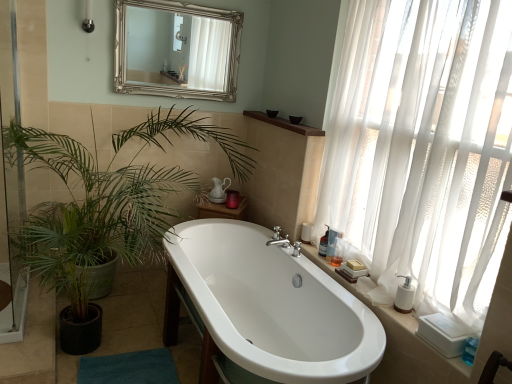
The width and height of the screenshot is (512, 384). What do you see at coordinates (106, 201) in the screenshot?
I see `green leafy plant at upper left` at bounding box center [106, 201].

Locate an element on the screen. Image resolution: width=512 pixels, height=384 pixels. white ceramic counter top at right is located at coordinates (401, 342).

The height and width of the screenshot is (384, 512). Find the location of `translucent plastic bottle at right, the 1th toiletry positioned from the front`. translucent plastic bottle at right, the 1th toiletry positioned from the front is located at coordinates [338, 251].

What is the approximate height of transparent glass screen door at left?

1.77 meters.

The image size is (512, 384). Identify the location of white glossy bathtub at center. (265, 309).

Considering the positions of objects transparent glass screen door at left and white matte soap dispenser at right in the image provided, who is more to the right, transparent glass screen door at left or white matte soap dispenser at right?

white matte soap dispenser at right.

Is point (1, 133) closer or farther from the camera than point (406, 286)?

Point (1, 133) appears to be farther away from the viewer than point (406, 286).

From a real-world perspective, is transparent glass screen door at left below white matte soap dispenser at right?

Actually, transparent glass screen door at left is physically above white matte soap dispenser at right in the real world.

What are the coordinates of `soap dispenser below the transparent glass screen door at left (from the image's perspective)` in the screenshot? It's located at (404, 296).

Would you say brown wood shelf at upper center is inside or outside white sheer curtain at right?

brown wood shelf at upper center is outside white sheer curtain at right.

Is brown wood shelf at upper center turned away from white sheer curtain at right?

No, brown wood shelf at upper center is not facing the opposite direction of white sheer curtain at right.

Is point (261, 113) positioned before point (439, 248)?

No.

Is white plastic soap dispenser at right, which appears as the 2th toiletry when viewed from the front, at the back of white glossy bathtub at center?

Yes, white glossy bathtub at center is positioned with its back facing white plastic soap dispenser at right, which appears as the 2th toiletry when viewed from the front.

Does white glossy bathtub at center have a greater width compared to white plastic soap dispenser at right, which is the 2th toiletry in back-to-front order?

Yes, white glossy bathtub at center is wider than white plastic soap dispenser at right, which is the 2th toiletry in back-to-front order.

Does point (174, 340) appear closer or farther from the camera than point (332, 232)?

Point (174, 340) appears to be farther away from the viewer than point (332, 232).

Between white glossy bathtub at center and white plastic soap dispenser at right, which appears as the 2th toiletry when viewed from the front, which one has more height?

Standing taller between the two is white glossy bathtub at center.

Based on the photo, visually, is transparent glass screen door at left positioned to the left or to the right of silver/gilded mirror at upper center?

transparent glass screen door at left is positioned on silver/gilded mirror at upper center's left side.

Does point (22, 158) lie behind point (136, 64)?

No, (22, 158) is closer to viewer.

Which object is more forward, transparent glass screen door at left or silver/gilded mirror at upper center?

transparent glass screen door at left is in front.

Is white plastic soap dispenser at right, which appears as the 2th toiletry when viewed from the front, closer to the viewer compared to white ceramic counter top at right?

That is False.

Which is behind, point (330, 253) or point (426, 375)?

Positioned behind is point (330, 253).

Are white plastic soap dispenser at right, which appears as the 2th toiletry when viewed from the front, and white ceramic counter top at right far apart?

No, white plastic soap dispenser at right, which appears as the 2th toiletry when viewed from the front, is in close proximity to white ceramic counter top at right.

From a real-world perspective, is white plastic soap dispenser at right, which appears as the 2th toiletry when viewed from the front, over white ceramic counter top at right?

Yes, from a real-world perspective, white plastic soap dispenser at right, which appears as the 2th toiletry when viewed from the front, is over white ceramic counter top at right

From a real-world perspective, is white matte soap dispenser at right above or below translucent plastic bottle at right, arranged as the 3th toiletry when viewed from the back?

white matte soap dispenser at right is below translucent plastic bottle at right, arranged as the 3th toiletry when viewed from the back.

Are white matte soap dispenser at right and translucent plastic bottle at right, arranged as the 3th toiletry when viewed from the back, far apart?

Actually, white matte soap dispenser at right and translucent plastic bottle at right, arranged as the 3th toiletry when viewed from the back, are a little close together.

Is white matte soap dispenser at right not inside translucent plastic bottle at right, arranged as the 3th toiletry when viewed from the back?

That's correct, white matte soap dispenser at right is outside of translucent plastic bottle at right, arranged as the 3th toiletry when viewed from the back.

Is white matte soap dispenser at right in front of or behind translucent plastic bottle at right, the 1th toiletry positioned from the front, in the image?

Visually, white matte soap dispenser at right is located in front of translucent plastic bottle at right, the 1th toiletry positioned from the front.

From a real-world perspective, is blue fabric bath mat at lower left below green leafy plant at upper left?

Yes, from a real-world perspective, blue fabric bath mat at lower left is below green leafy plant at upper left.

Does blue fabric bath mat at lower left have a greater height compared to green leafy plant at upper left?

No, blue fabric bath mat at lower left is not taller than green leafy plant at upper left.

Is blue fabric bath mat at lower left aimed at green leafy plant at upper left?

No, blue fabric bath mat at lower left is not facing towards green leafy plant at upper left.

Does blue fabric bath mat at lower left have a lesser width compared to green leafy plant at upper left?

Yes, blue fabric bath mat at lower left is thinner than green leafy plant at upper left.

Image resolution: width=512 pixels, height=384 pixels. In order to click on soap dispenser located underneath the transparent glass screen door at left (from a real-world perspective) in this screenshot , I will do `click(404, 296)`.

The image size is (512, 384). I want to click on curtain above the brown wood shelf at upper center (from a real-world perspective), so click(x=423, y=146).

Which object lies nearer to the anchor point translucent plastic bottle at right, which appears as the 3th toiletry when viewed from the front, white ceramic counter top at right or blue fabric bath mat at lower left?

white ceramic counter top at right is closer to translucent plastic bottle at right, which appears as the 3th toiletry when viewed from the front.

Which object lies further to the anchor point translucent plastic bottle at right, which appears as the 3th toiletry when viewed from the front, brown wood shelf at upper center or white plastic soap dispenser at right, which is the 2th toiletry in back-to-front order?

brown wood shelf at upper center is positioned further to the anchor translucent plastic bottle at right, which appears as the 3th toiletry when viewed from the front.

Based on their spatial positions, is brown wood shelf at upper center or white sheer curtain at right closer to green leafy plant at upper left?

The object closer to green leafy plant at upper left is brown wood shelf at upper center.

Looking at this image, when comparing their distances from blue fabric bath mat at lower left, does translucent plastic bottle at right, which appears as the 3th toiletry when viewed from the front, or white plastic soap dispenser at right, which appears as the 2th toiletry when viewed from the front, seem closer?

translucent plastic bottle at right, which appears as the 3th toiletry when viewed from the front, is positioned closer to the anchor blue fabric bath mat at lower left.

Which object lies nearer to the anchor point white ceramic counter top at right, translucent plastic bottle at right, the 1th toiletry positioned from the back, or white glossy bathtub at center?

Among the two, white glossy bathtub at center is located nearer to white ceramic counter top at right.

Based on their spatial positions, is transparent glass screen door at left or white sheer curtain at right closer to white plastic soap dispenser at right, which appears as the 2th toiletry when viewed from the front?

white sheer curtain at right is positioned closer to the anchor white plastic soap dispenser at right, which appears as the 2th toiletry when viewed from the front.

Which object lies nearer to the anchor point silver/gilded mirror at upper center, blue fabric bath mat at lower left or white ceramic counter top at right?

white ceramic counter top at right lies closer to silver/gilded mirror at upper center than the other object.

Which object lies further to the anchor point white ceramic counter top at right, white matte soap dispenser at right or blue fabric bath mat at lower left?

blue fabric bath mat at lower left is positioned further to the anchor white ceramic counter top at right.

At what (x,y) coordinates should I click in order to perform the action: click on mirror between transparent glass screen door at left and translucent plastic bottle at right, the 1th toiletry positioned from the front, from left to right. Please return your answer as a coordinate pair (x, y). The height and width of the screenshot is (384, 512). Looking at the image, I should click on (177, 49).

You are a GUI agent. You are given a task and a screenshot of the screen. Output one action in this format:
    pyautogui.click(x=<x>, y=<y>)
    Task: Click on the soap dispenser between white sheer curtain at right and translucent plastic bottle at right, which appears as the 3th toiletry when viewed from the front, in the front-back direction
    Image resolution: width=512 pixels, height=384 pixels.
    Given the screenshot: What is the action you would take?
    pyautogui.click(x=404, y=296)

Where is `mirror between transparent glass screen door at left and translucent plastic bottle at right, which appears as the 3th toiletry when viewed from the front`? The image size is (512, 384). mirror between transparent glass screen door at left and translucent plastic bottle at right, which appears as the 3th toiletry when viewed from the front is located at coordinates (177, 49).

You are a GUI agent. You are given a task and a screenshot of the screen. Output one action in this format:
    pyautogui.click(x=<x>, y=<y>)
    Task: Click on the soap dispenser between silver/gilded mirror at upper center and white ceramic counter top at right in the up-down direction
    This screenshot has width=512, height=384.
    Given the screenshot: What is the action you would take?
    pyautogui.click(x=404, y=296)